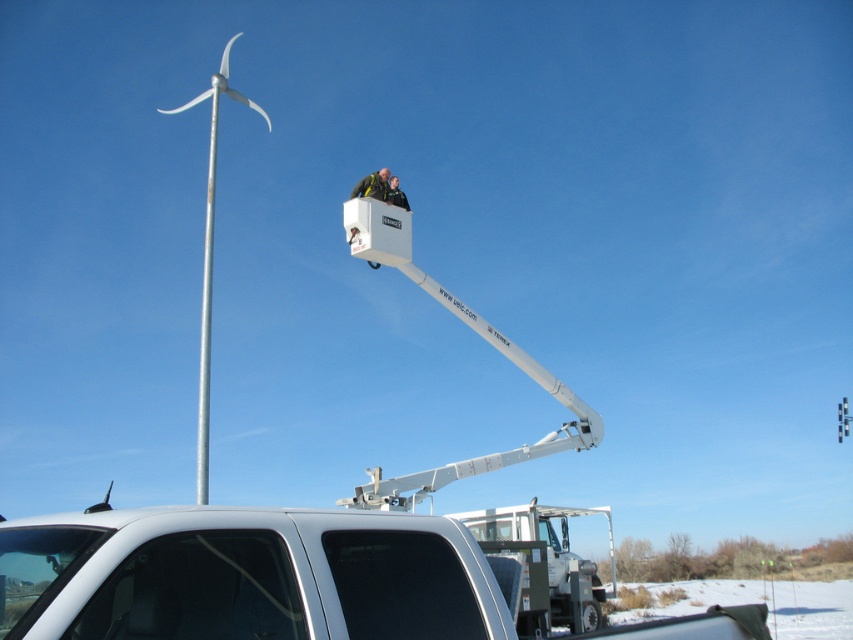
You are a construction worker planning to transport both the white glossy pickup truck at lower left and the white plastic trailer truck at lower right to a job site. Which vehicle should you choose as the primary transport if you need to tow the other? Explain your choice based on their sizes.

The white plastic trailer truck at lower right should be chosen as the primary transport because it is larger than the white glossy pickup truck at lower left, making it more capable of towing the smaller vehicle.